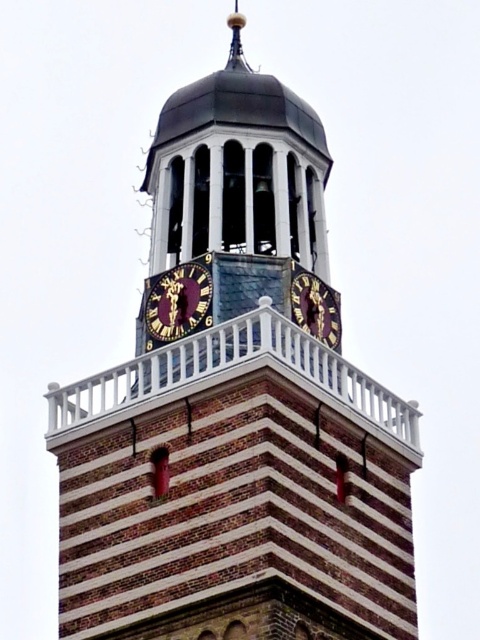
You are standing in front of the clock tower and see two gold metallic clocks. One is labeled as the gold metallic clock at center and the other as the gold metallic clock at upper center. Which clock is positioned to the left of the other?

The gold metallic clock at center is to the left of the gold metallic clock at upper center.

You are standing in front of the clock tower and want to know the exact location of the gold metallic clock at center. Can you describe its position using coordinates?

The gold metallic clock at center is located at coordinates point (178, 301).